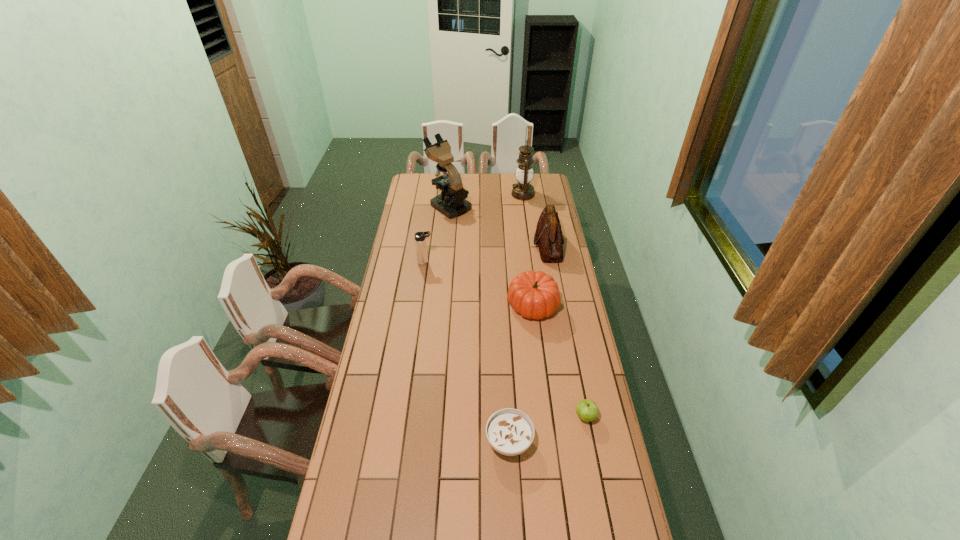
Where is `vacant area situated 0.140m on the left of the fifth shortest object`? Image resolution: width=960 pixels, height=540 pixels. vacant area situated 0.140m on the left of the fifth shortest object is located at coordinates (506, 246).

I want to click on free location located on the handle side of the thermos bottle, so click(x=465, y=262).

This screenshot has width=960, height=540. Find the location of `vacant space situated 0.090m on the right of the third nearest object`. vacant space situated 0.090m on the right of the third nearest object is located at coordinates (579, 305).

You are a GUI agent. You are given a task and a screenshot of the screen. Output one action in this format:
    pyautogui.click(x=<x>, y=<y>)
    Task: Click on the blank space located on the left of the apple
    The height and width of the screenshot is (540, 960).
    Given the screenshot: What is the action you would take?
    pyautogui.click(x=470, y=416)

Find the location of a particular element. free location located on the left of the soup bowl is located at coordinates (458, 441).

Find the location of `oil lamp situated at the far edge`. oil lamp situated at the far edge is located at coordinates (523, 190).

I want to click on microscope that is at the far edge, so 452,203.

Find the location of a particular element. Image resolution: width=960 pixels, height=540 pixels. microscope situated at the left edge is located at coordinates (452, 203).

Identify the location of thermos bottle present at the left edge. (420, 242).

In order to click on oil lamp positioned at the right edge in this screenshot , I will do `click(523, 190)`.